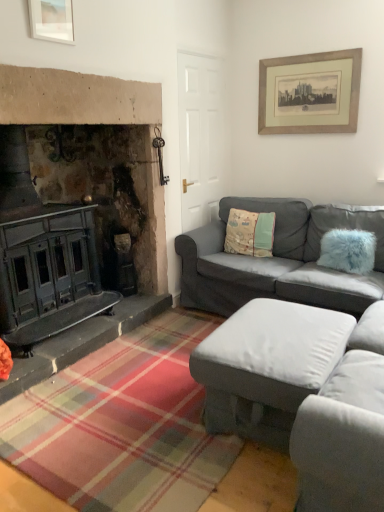
Question: From a real-world perspective, is gray fabric couch at right, placed as the 1th studio couch when sorted from back to front, physically above beige wooden picture frame at upper right, acting as the 1th picture frame starting from the back?

Choices:
 (A) no
 (B) yes

Answer: (A)

Question: Considering the relative sizes of gray fabric couch at right, placed as the 1th studio couch when sorted from back to front, and beige wooden picture frame at upper right, marked as the 2th picture frame in a front-to-back arrangement, in the image provided, is gray fabric couch at right, placed as the 1th studio couch when sorted from back to front, thinner than beige wooden picture frame at upper right, marked as the 2th picture frame in a front-to-back arrangement,?

Choices:
 (A) yes
 (B) no

Answer: (B)

Question: Is gray fabric couch at right, the second studio couch in the front-to-back sequence, positioned with its back to beige wooden picture frame at upper right, acting as the 1th picture frame starting from the back?

Choices:
 (A) yes
 (B) no

Answer: (B)

Question: Are gray fabric couch at right, the second studio couch in the front-to-back sequence, and beige wooden picture frame at upper right, marked as the 2th picture frame in a front-to-back arrangement, beside each other?

Choices:
 (A) no
 (B) yes

Answer: (A)

Question: From a real-world perspective, is gray fabric couch at right, the second studio couch in the front-to-back sequence, below beige wooden picture frame at upper right, acting as the 1th picture frame starting from the back?

Choices:
 (A) yes
 (B) no

Answer: (A)

Question: Is beige wooden picture frame at upper right, the second picture frame in the left-to-right sequence, in front of or behind fuzzy blue pillow at right, which is the 2th pillow in left-to-right order, in the image?

Choices:
 (A) behind
 (B) front

Answer: (A)

Question: Considering the positions of beige wooden picture frame at upper right, the 1th picture frame in the right-to-left sequence, and fuzzy blue pillow at right, positioned as the 1th pillow in right-to-left order, in the image, is beige wooden picture frame at upper right, the 1th picture frame in the right-to-left sequence, wider or thinner than fuzzy blue pillow at right, positioned as the 1th pillow in right-to-left order,?

Choices:
 (A) thin
 (B) wide

Answer: (A)

Question: Is beige wooden picture frame at upper right, the second picture frame in the left-to-right sequence, to the left or to the right of fuzzy blue pillow at right, the second pillow in the back-to-front sequence, in the image?

Choices:
 (A) left
 (B) right

Answer: (A)

Question: Looking at the image, does beige wooden picture frame at upper right, the second picture frame in the left-to-right sequence, seem bigger or smaller compared to fuzzy blue pillow at right, positioned as the 1th pillow in right-to-left order?

Choices:
 (A) big
 (B) small

Answer: (B)

Question: From the image's perspective, relative to fuzzy blue pillow at right, which is the 2th pillow in left-to-right order, is fluffy fabric pillow at center, arranged as the 2th pillow when viewed from the right, above or below?

Choices:
 (A) above
 (B) below

Answer: (A)

Question: In the image, is fluffy fabric pillow at center, placed as the 2th pillow when sorted from front to back, on the left side or the right side of fuzzy blue pillow at right, the second pillow in the back-to-front sequence?

Choices:
 (A) left
 (B) right

Answer: (A)

Question: Is fluffy fabric pillow at center, placed as the 2th pillow when sorted from front to back, taller or shorter than fuzzy blue pillow at right, the second pillow in the back-to-front sequence?

Choices:
 (A) tall
 (B) short

Answer: (A)

Question: Considering the positions of fluffy fabric pillow at center, placed as the 2th pillow when sorted from front to back, and fuzzy blue pillow at right, positioned as the 1th pillow in right-to-left order, in the image, is fluffy fabric pillow at center, placed as the 2th pillow when sorted from front to back, wider or thinner than fuzzy blue pillow at right, positioned as the 1th pillow in right-to-left order,?

Choices:
 (A) wide
 (B) thin

Answer: (B)

Question: Is fuzzy blue pillow at right, the second pillow in the back-to-front sequence, in front of or behind matte white picture frame at upper left, which appears as the 1th picture frame when viewed from the front, in the image?

Choices:
 (A) front
 (B) behind

Answer: (B)

Question: From a real-world perspective, relative to matte white picture frame at upper left, which is counted as the 2th picture frame, starting from the back, is fuzzy blue pillow at right, the 1th pillow when ordered from front to back, vertically above or below?

Choices:
 (A) above
 (B) below

Answer: (B)